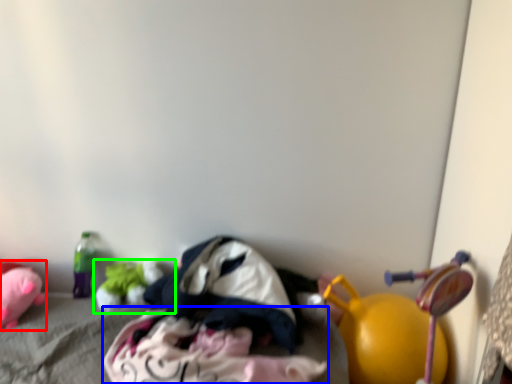
Question: Based on their relative distances, which object is farther from toy (highlighted by a red box)? Choose from clothing (highlighted by a blue box) and toy (highlighted by a green box).

Choices:
 (A) clothing
 (B) toy

Answer: (A)